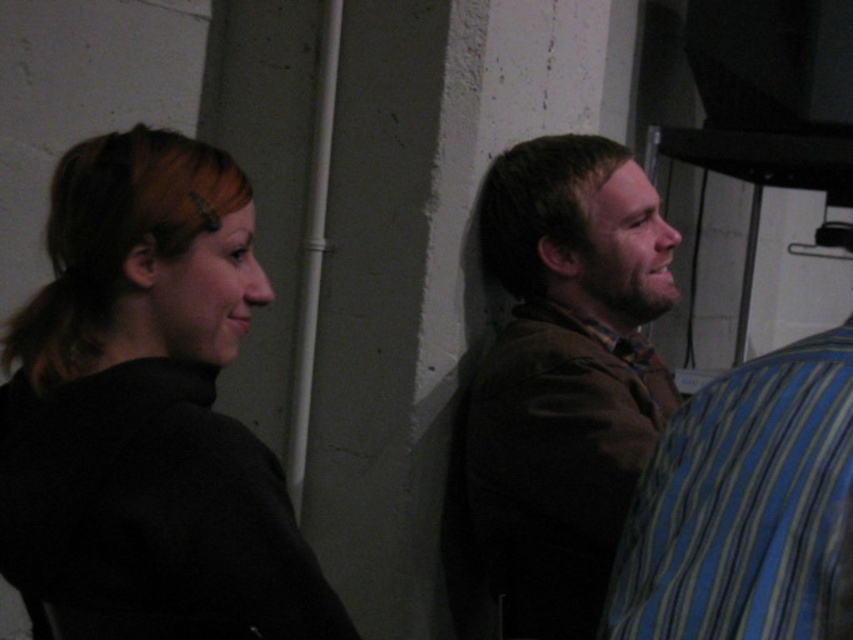
Question: Which point is farther to the camera?

Choices:
 (A) 496,506
 (B) 686,492

Answer: (A)

Question: Does brown fabric jacket at center come behind blue striped shirt at right?

Choices:
 (A) yes
 (B) no

Answer: (A)

Question: Which of the following is the farthest from the observer?

Choices:
 (A) black matte hair at left
 (B) blue striped shirt at right

Answer: (A)

Question: Which point is closer to the camera taking this photo?

Choices:
 (A) 654,573
 (B) 604,387

Answer: (A)

Question: Is black matte hair at left to the right of blue striped shirt at right from the viewer's perspective?

Choices:
 (A) no
 (B) yes

Answer: (A)

Question: Does black matte hair at left lie behind blue striped shirt at right?

Choices:
 (A) yes
 (B) no

Answer: (A)